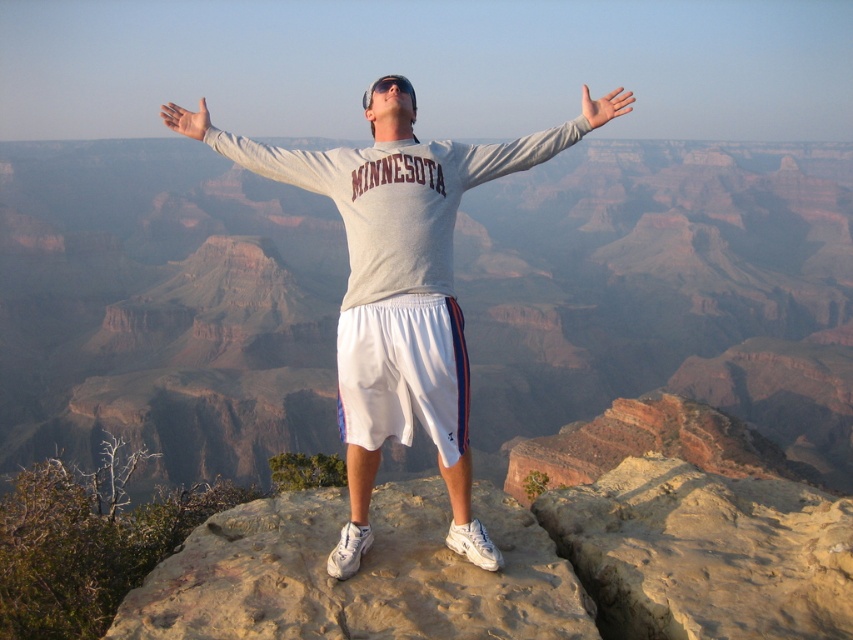
Question: Is gray matte arm at center wider than white matte hand at upper center?

Choices:
 (A) no
 (B) yes

Answer: (A)

Question: Is smooth beige rock at center above white matte hand at center?

Choices:
 (A) no
 (B) yes

Answer: (A)

Question: Which of these objects is positioned closest to the white matte hand at upper center?

Choices:
 (A) gray cotton sweatshirt at center
 (B) white matte hand at center
 (C) gray matte long-sleeve shirt at upper center

Answer: (A)

Question: Considering the real-world distances, which object is closest to the smooth beige rock at center?

Choices:
 (A) gray matte long-sleeve shirt at upper center
 (B) gray matte arm at center
 (C) gray cotton sweatshirt at center
 (D) white matte hand at center

Answer: (C)

Question: Which of these objects is positioned closest to the smooth beige rock at center?

Choices:
 (A) white matte hand at center
 (B) gray cotton sweatshirt at center
 (C) white matte hand at upper center
 (D) gray matte arm at center

Answer: (B)

Question: Can you confirm if gray matte long-sleeve shirt at upper center is positioned below white matte hand at center?

Choices:
 (A) no
 (B) yes

Answer: (B)